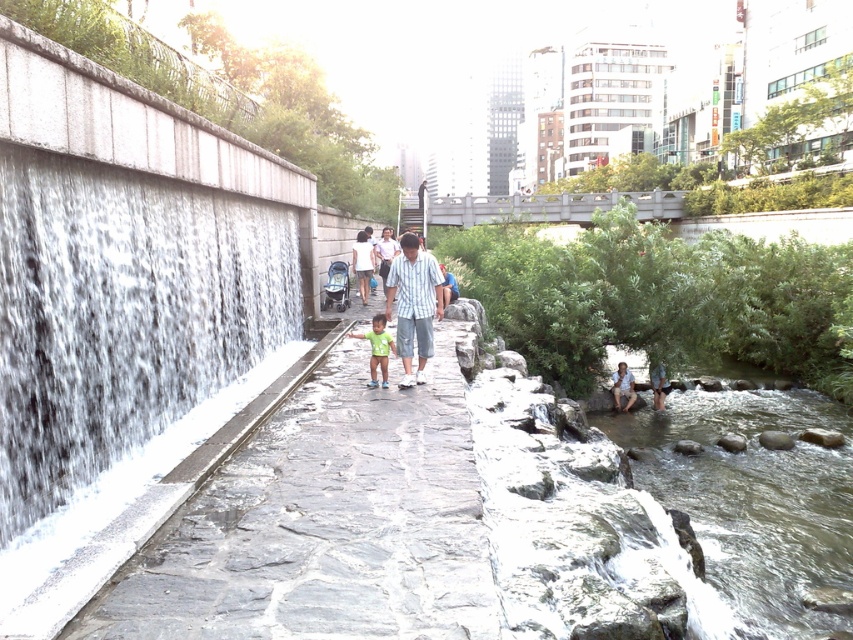
You are a photographer standing at the waterfall on the left side of the park. You see two people walking on the paved pathway at center wearing a striped cotton shirt at center and a green matte shirt at center. Which person is shorter?

The striped cotton shirt at center is worn by a person who is shorter than the one wearing the green matte shirt at center.

You are standing at the start of the paved pathway in the urban park and see both the striped cotton shirt at center and the green matte shirt at center. Which person should you approach first if you want to greet the one closer to you?

You should approach the striped cotton shirt at center first because it is closer to you than the green matte shirt at center.

You are a park visitor holding a 24 inch wide picnic basket. You want to walk along the paved pathway while keeping the striped cotton shirt at center and the green matte shirt at center between you and the waterfall. Is there enough space between them to carry the basket without moving closer than 12 inches to either shirt?

The distance between the striped cotton shirt at center and the green matte shirt at center is 31.62 inches. Subtracting the required 12 inches from each side for safety, the remaining space is 31.62 minus 24 equals 7.62 inches. Since 7.62 inches is less than the 24 inch width of the picnic basket, there isn t enough space to carry the basket between them without getting too close.